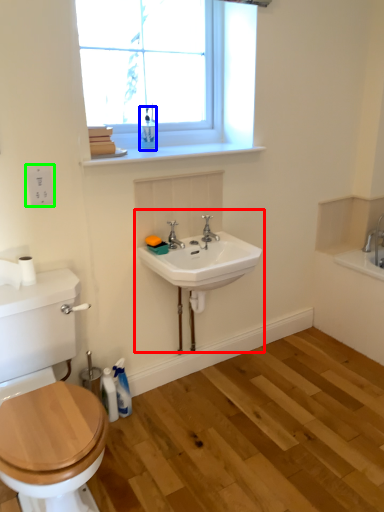
Question: Which is farther away from sink (highlighted by a red box)? toiletry (highlighted by a blue box) or electric outlet (highlighted by a green box)?

Choices:
 (A) toiletry
 (B) electric outlet

Answer: (B)